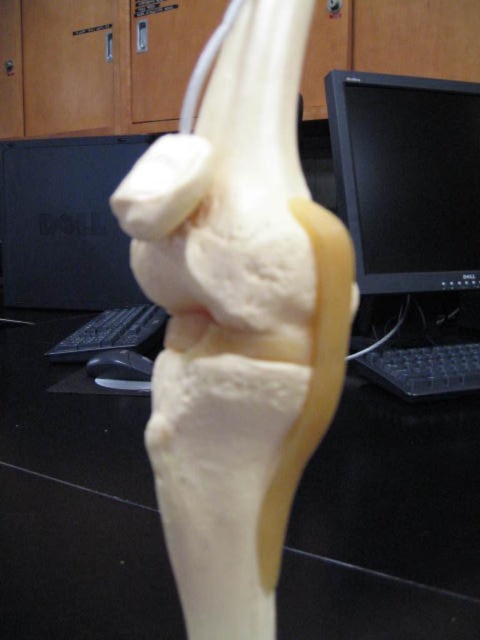
Question: Which point is closer to the camera taking this photo?

Choices:
 (A) (437, 456)
 (B) (440, 266)

Answer: (A)

Question: In this image, where is black plastic keyboard at center located relative to black glossy monitor at upper right?

Choices:
 (A) above
 (B) below

Answer: (B)

Question: Is black plastic keyboard at center positioned before black glossy monitor at upper right?

Choices:
 (A) yes
 (B) no

Answer: (A)

Question: Which of the following is the farthest from the observer?

Choices:
 (A) black glossy monitor at upper right
 (B) black plastic keyboard at center

Answer: (A)

Question: Does black plastic keyboard at center have a larger size compared to black glossy monitor at upper right?

Choices:
 (A) no
 (B) yes

Answer: (A)